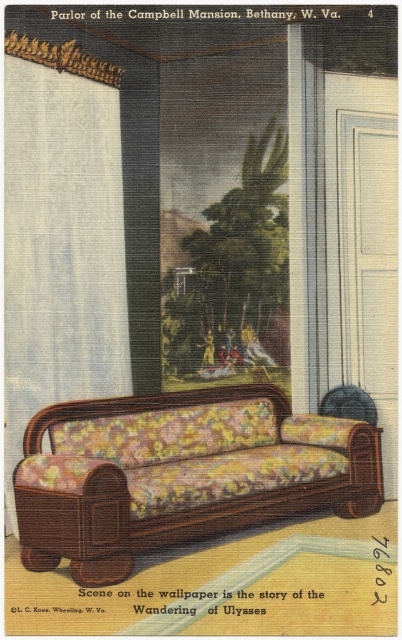
Question: Is floral fabric couch at center further to camera compared to white textured curtain at left?

Choices:
 (A) no
 (B) yes

Answer: (A)

Question: Which point is closer to the camera?

Choices:
 (A) white textured curtain at left
 (B) floral fabric couch at center

Answer: (B)

Question: Considering the relative positions of floral fabric couch at center and white textured curtain at left in the image provided, where is floral fabric couch at center located with respect to white textured curtain at left?

Choices:
 (A) right
 (B) left

Answer: (A)

Question: Considering the relative positions of floral fabric couch at center and white textured curtain at left in the image provided, where is floral fabric couch at center located with respect to white textured curtain at left?

Choices:
 (A) right
 (B) left

Answer: (A)